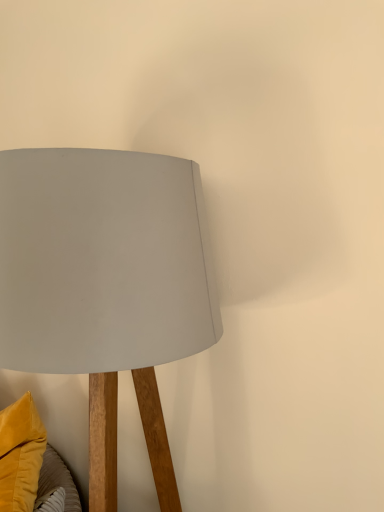
The height and width of the screenshot is (512, 384). In order to click on matte gray lampshade at center in this screenshot , I will do `click(106, 285)`.

In order to face matte gray lampshade at center, should I rotate leftwards or rightwards?

To face it directly, rotate left by 12.728 degrees.

What do you see at coordinates (106, 285) in the screenshot? This screenshot has height=512, width=384. I see `matte gray lampshade at center` at bounding box center [106, 285].

Locate an element on the screen. The image size is (384, 512). matte gray lampshade at center is located at coordinates (106, 285).